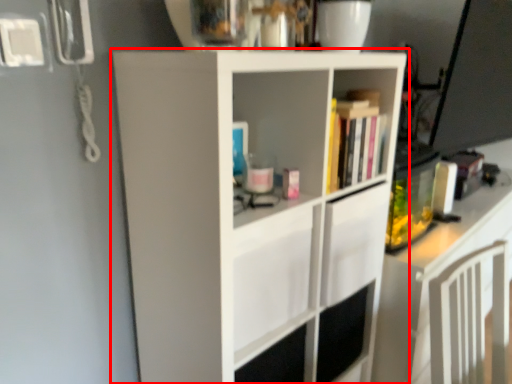
Question: From the image's perspective, what is the correct spatial relationship of cupboard (annotated by the red box) in relation to shelf?

Choices:
 (A) above
 (B) below

Answer: (B)